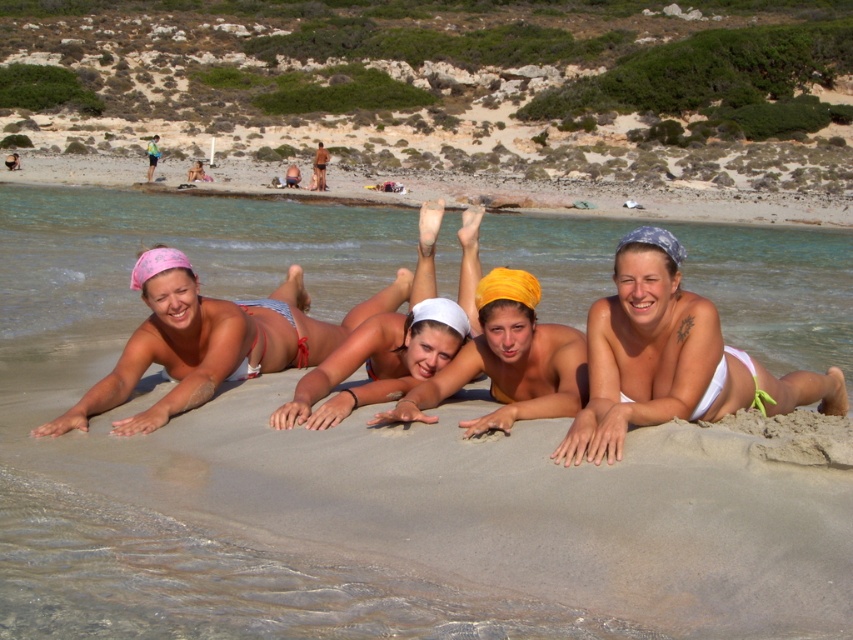
Question: Can you confirm if white matte bikini at center is wider than yellow fabric headscarf at center?

Choices:
 (A) no
 (B) yes

Answer: (B)

Question: Can you confirm if white matte bikini at center is thinner than yellow fabric headscarf at center?

Choices:
 (A) no
 (B) yes

Answer: (A)

Question: Which point is farther to the camera?

Choices:
 (A) (569, 221)
 (B) (422, 291)

Answer: (A)

Question: Which is nearer to the pink fabric bikini at center?

Choices:
 (A) matte white bikini at center
 (B) yellow fabric headscarf at center
 (C) white sand at center

Answer: (A)

Question: Which is nearer to the matte white bikini at center?

Choices:
 (A) white sand at center
 (B) yellow fabric headscarf at center
 (C) pink fabric bikini at center
 (D) white matte bikini at center

Answer: (B)

Question: Is white sand at center wider than pink fabric bikini at center?

Choices:
 (A) no
 (B) yes

Answer: (B)